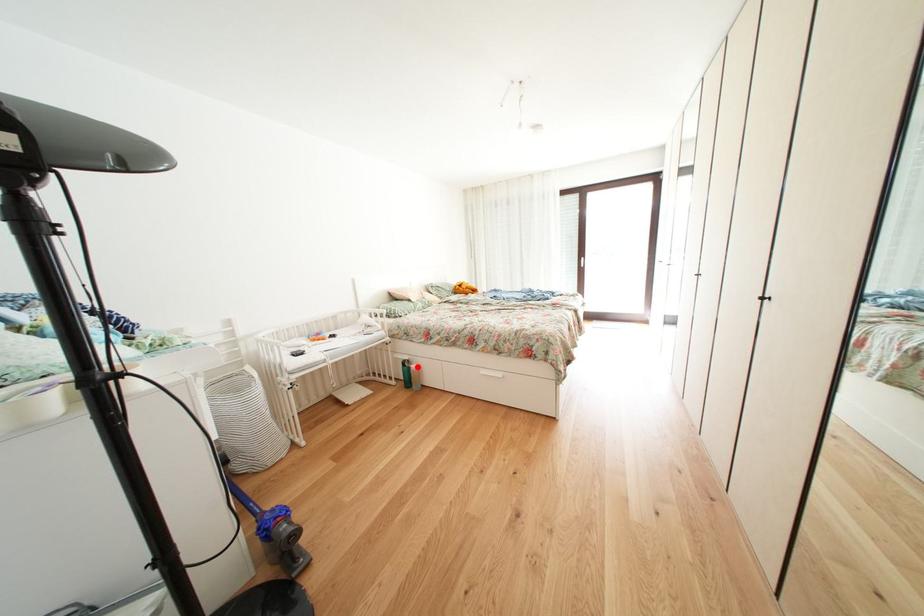
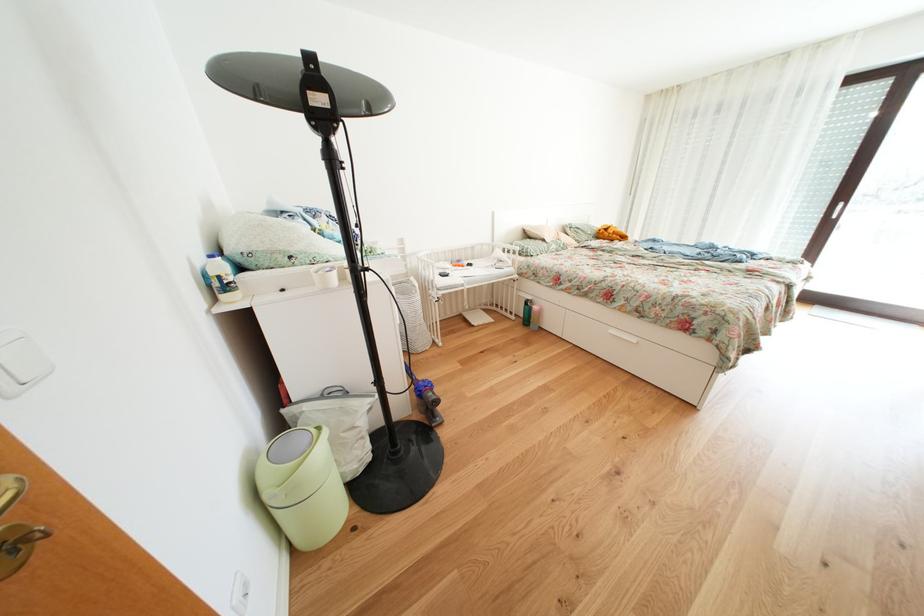
Question: I am providing you with two images of the same scene from different viewpoints. A red point is shown in image1. For the corresponding object point in image2, is it positioned nearer or farther from the camera?

Choices:
 (A) Nearer
 (B) Farther

Answer: (A)